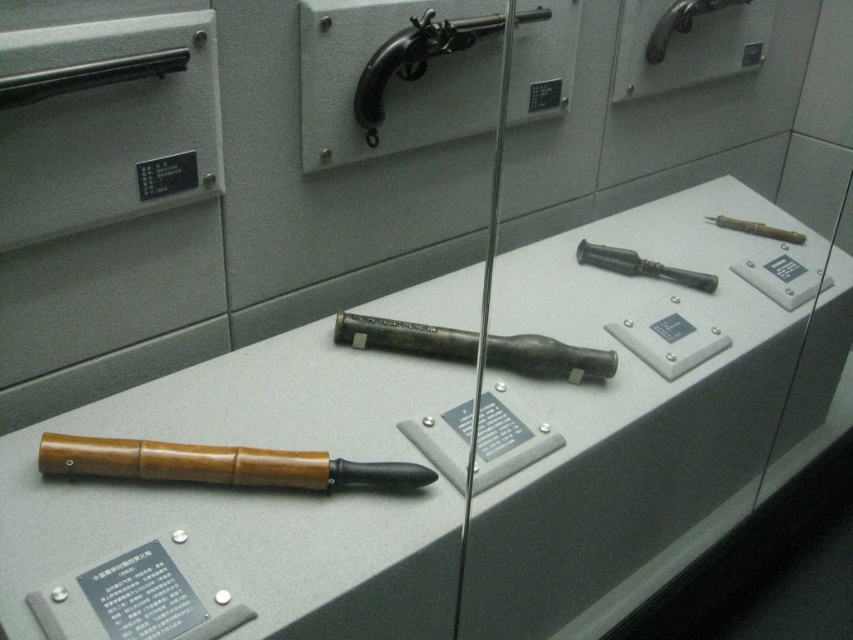
Question: In this image, where is wooden handle knife at lower left located relative to brown wood/leather pipe at center?

Choices:
 (A) right
 (B) left

Answer: (B)

Question: Which point is closer to the camera?

Choices:
 (A) (358, 321)
 (B) (370, 138)
 (C) (305, 484)

Answer: (C)

Question: Does wooden handle knife at lower left have a larger size compared to brown wood/leather pipe at center?

Choices:
 (A) yes
 (B) no

Answer: (B)

Question: Among these objects, which one is nearest to the camera?

Choices:
 (A) matte gray display case at center
 (B) matte black gun at upper left
 (C) wooden handle knife at lower left
 (D) matte silver pipe at upper center

Answer: (A)

Question: Which object is closer to the camera taking this photo?

Choices:
 (A) matte gray display case at center
 (B) polished metal pistol at upper center

Answer: (A)

Question: Is matte gray display case at center wider than matte silver pipe at upper center?

Choices:
 (A) yes
 (B) no

Answer: (A)